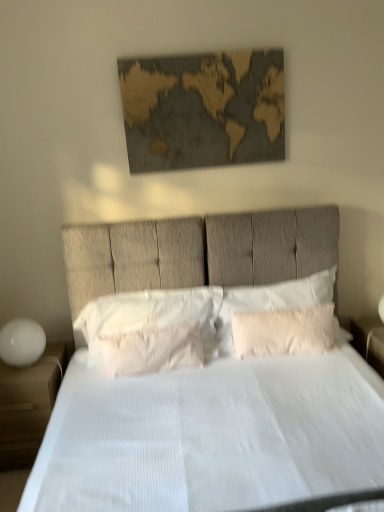
Question: Is white glossy nightstand at right, the 2th nightstand from the left, closer to camera compared to white textured pillow at center, which appears as the 1th pillow when viewed from the left?

Choices:
 (A) yes
 (B) no

Answer: (B)

Question: Is white glossy nightstand at right, placed as the first nightstand when sorted from right to left, behind white textured pillow at center, the third pillow from the right?

Choices:
 (A) yes
 (B) no

Answer: (A)

Question: Does white glossy nightstand at right, placed as the first nightstand when sorted from right to left, have a greater height compared to white textured pillow at center, which appears as the 1th pillow when viewed from the left?

Choices:
 (A) no
 (B) yes

Answer: (A)

Question: Does white glossy nightstand at right, placed as the first nightstand when sorted from right to left, appear on the left side of white textured pillow at center, which appears as the 1th pillow when viewed from the left?

Choices:
 (A) yes
 (B) no

Answer: (B)

Question: Is white glossy nightstand at right, the 2th nightstand from the left, facing away from white textured pillow at center, the third pillow from the right?

Choices:
 (A) no
 (B) yes

Answer: (A)

Question: Is white glossy nightstand at right, placed as the first nightstand when sorted from right to left, surrounding white textured pillow at center, which appears as the 1th pillow when viewed from the left?

Choices:
 (A) no
 (B) yes

Answer: (A)

Question: Is white glossy sphere at left thinner than white textured pillow at center, which appears as the 1th pillow when viewed from the left?

Choices:
 (A) yes
 (B) no

Answer: (B)

Question: Can you confirm if white glossy sphere at left is wider than white textured pillow at center, the third pillow from the right?

Choices:
 (A) no
 (B) yes

Answer: (B)

Question: From the image's perspective, would you say white glossy sphere at left is shown under white textured pillow at center, the third pillow from the right?

Choices:
 (A) no
 (B) yes

Answer: (B)

Question: Is white glossy sphere at left further to camera compared to white textured pillow at center, which appears as the 1th pillow when viewed from the left?

Choices:
 (A) yes
 (B) no

Answer: (A)

Question: Would you say white textured pillow at center, the third pillow from the right, is part of white glossy sphere at left's contents?

Choices:
 (A) yes
 (B) no

Answer: (B)

Question: From a real-world perspective, is white glossy sphere at left physically above white textured pillow at center, the third pillow from the right?

Choices:
 (A) yes
 (B) no

Answer: (B)

Question: From the image's perspective, is white matte nightstand at lower left, which is counted as the first nightstand, starting from the left, above white textured pillow at center, which is counted as the 1th pillow, starting from the right?

Choices:
 (A) yes
 (B) no

Answer: (B)